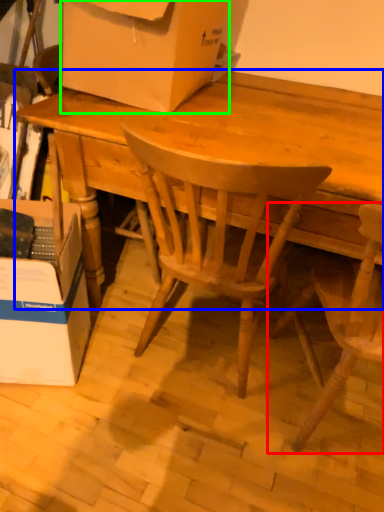
Question: Estimate the real-world distances between objects in this image. Which object is farther from chair (highlighted by a red box), desk (highlighted by a blue box) or box (highlighted by a green box)?

Choices:
 (A) desk
 (B) box

Answer: (B)